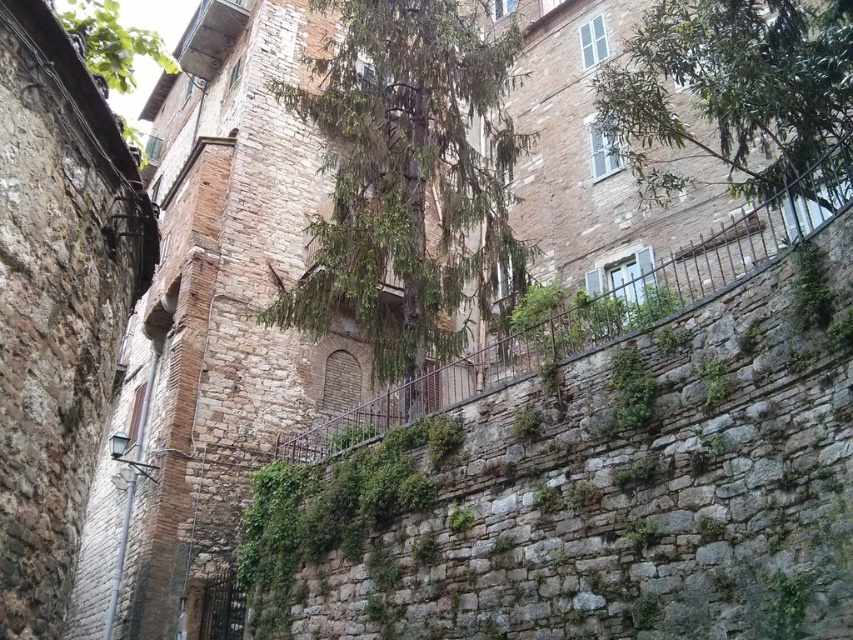
Between green leafy tree at center and green leafy tree at upper center, which one is positioned lower?

green leafy tree at upper center

The image size is (853, 640). Identify the location of green leafy tree at center. (407, 177).

The height and width of the screenshot is (640, 853). Find the location of `green leafy tree at center`. green leafy tree at center is located at coordinates (407, 177).